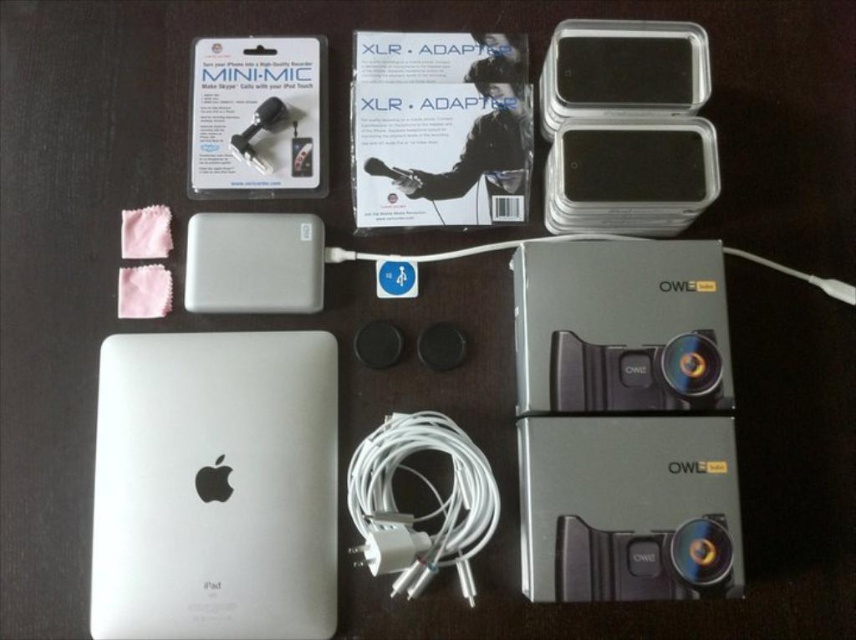
You are an assistant organizing items on a desk. You need to place a new item at the point specified by the coordinates. The coordinates given are point [257,116]. Which item should you place there?

The coordinates point [257,116] corresponds to the matte black mini mic at upper left, so you should place the matte black mini mic at upper left there.